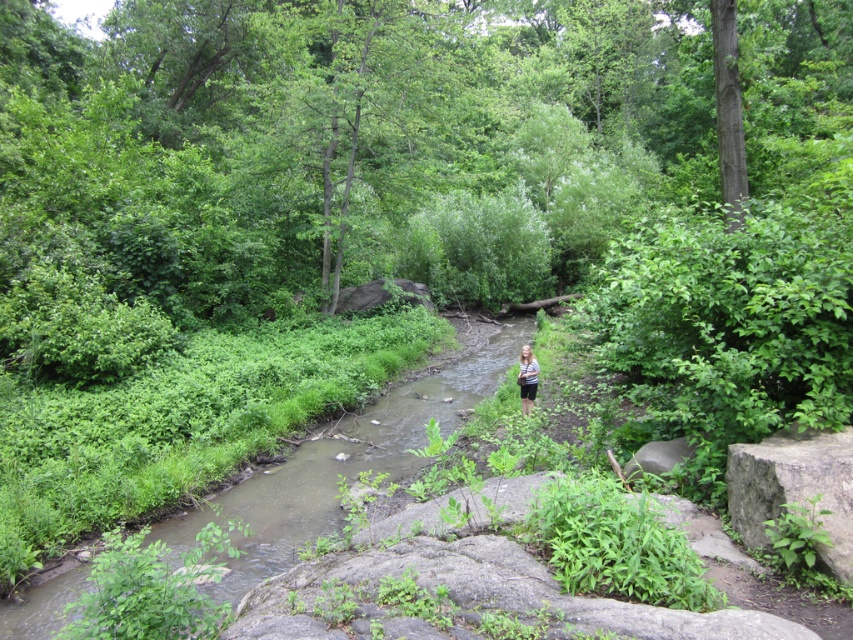
You are standing at the edge of the stream and see the gray rough stone at lower right and the striped fabric shirt at center. Which object is nearer to you?

The gray rough stone at lower right is closer to the viewer than the striped fabric shirt at center.